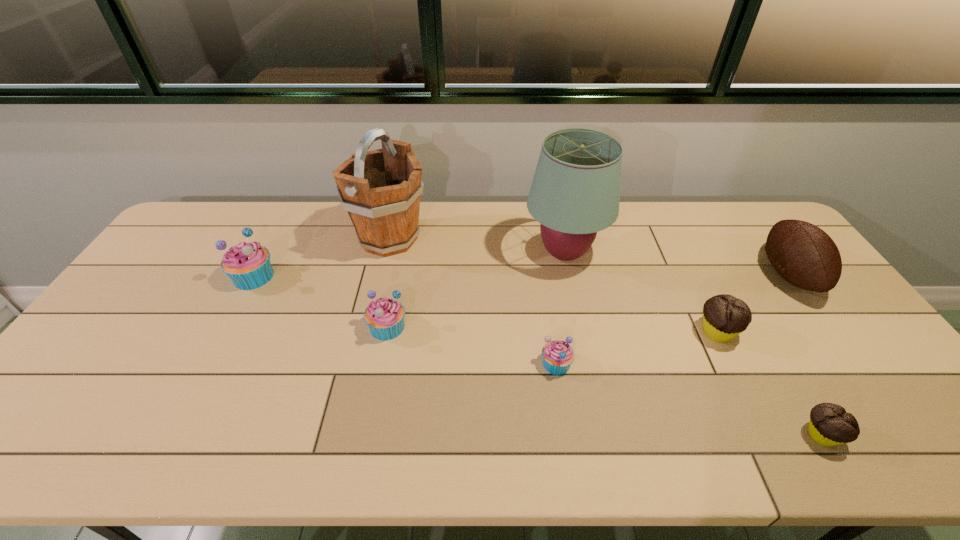
Identify the location of vacant area that lies between the bucket and the rightmost blue muffin. The height and width of the screenshot is (540, 960). (472, 301).

The image size is (960, 540). In order to click on free spot between the second blue muffin from left to right and the blue lampshade in this screenshot , I will do `click(476, 290)`.

Where is `empty space between the nearer chocolate muffin and the leftmost muffin`? empty space between the nearer chocolate muffin and the leftmost muffin is located at coordinates (538, 356).

This screenshot has width=960, height=540. I want to click on free space between the nearest muffin and the lampshade, so click(692, 344).

Where is `vacant space in between the rightmost muffin and the third muffin from right to left`? Image resolution: width=960 pixels, height=540 pixels. vacant space in between the rightmost muffin and the third muffin from right to left is located at coordinates (688, 399).

Identify the location of the seventh closest object to the football. This screenshot has width=960, height=540. (248, 265).

The width and height of the screenshot is (960, 540). What are the coordinates of `object that is the second closest to the bucket` in the screenshot? It's located at (385, 317).

Identify the location of muffin that stands as the fourth closest to the bucket. Image resolution: width=960 pixels, height=540 pixels. (724, 316).

The image size is (960, 540). What are the coordinates of `the second closest muffin relative to the football` in the screenshot? It's located at (830, 425).

At what (x,y) coordinates should I click in order to perform the action: click on blue muffin that is the second closest to the biggest blue muffin. Please return your answer as a coordinate pair (x, y). Looking at the image, I should click on (557, 355).